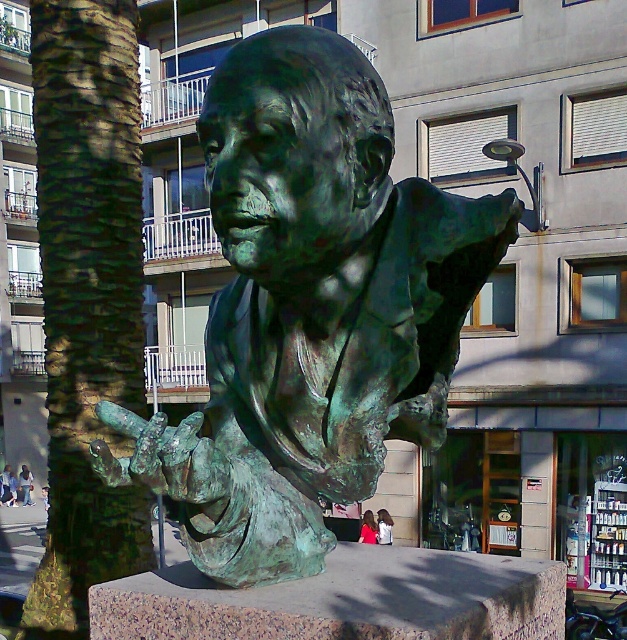
Consider the image. Which of these two, green patina bust at center or pink fabric at lower center, stands shorter?

pink fabric at lower center

Is green patina bust at center positioned at the back of pink fabric at lower center?

No, green patina bust at center is in front of pink fabric at lower center.

Does point (366, 372) lie in front of point (362, 532)?

Yes, it is in front of point (362, 532).

The height and width of the screenshot is (640, 627). I want to click on green patina bust at center, so click(308, 308).

Between point (43, 67) and point (386, 513), which one is positioned behind?

Positioned behind is point (386, 513).

Between green textured bark at left and red shirt at lower center, which one is positioned lower?

red shirt at lower center

Where is `green textured bark at left`? This screenshot has height=640, width=627. green textured bark at left is located at coordinates (87, 296).

Image resolution: width=627 pixels, height=640 pixels. Identify the location of green textured bark at left. (87, 296).

Which of these two, green textured bark at left or dark blue jeans at lower left, stands shorter?

dark blue jeans at lower left

Is point (45, 36) in front of point (24, 477)?

Yes.

In order to click on green textured bark at left in this screenshot , I will do `click(87, 296)`.